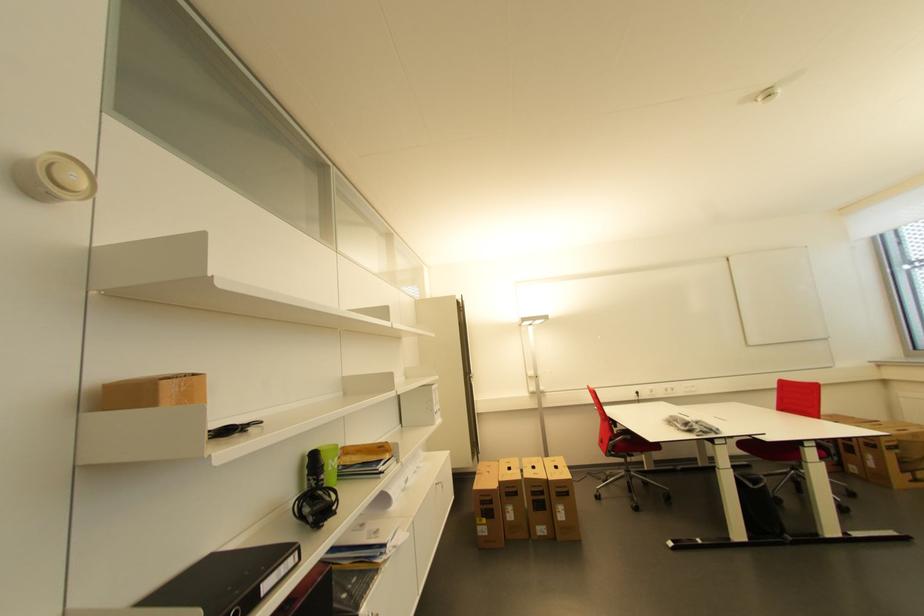
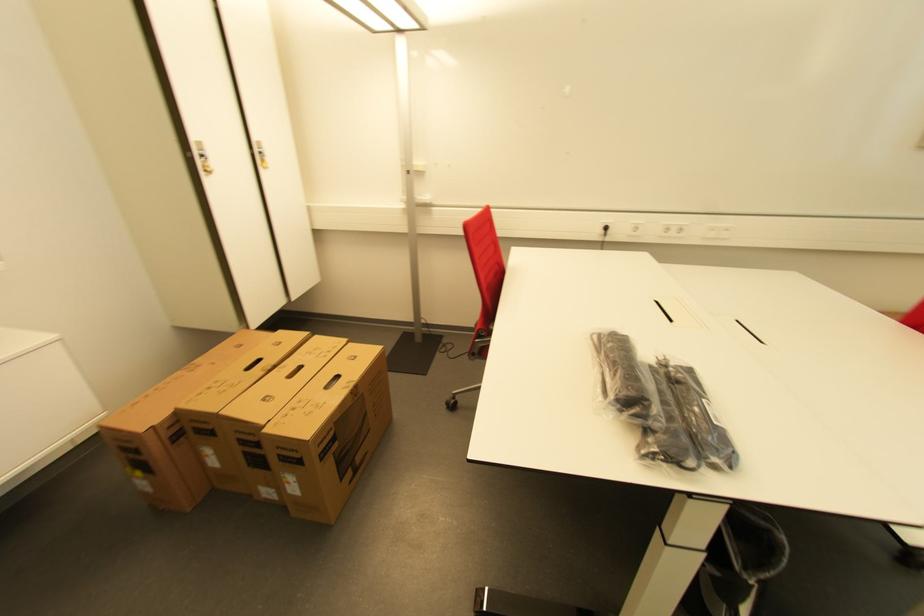
In the second image, find the point that corresponds to [642,394] in the first image.

(611, 230)